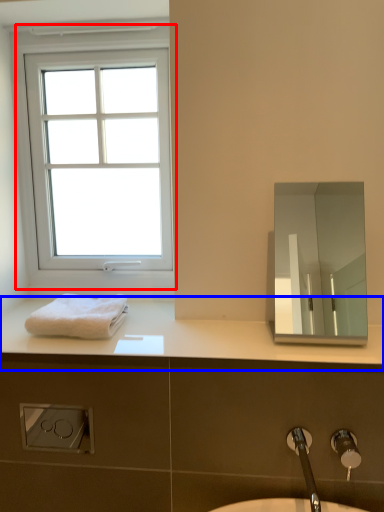
Question: Which object is closer to the camera taking this photo, window (highlighted by a red box) or counter top (highlighted by a blue box)?

Choices:
 (A) window
 (B) counter top

Answer: (B)